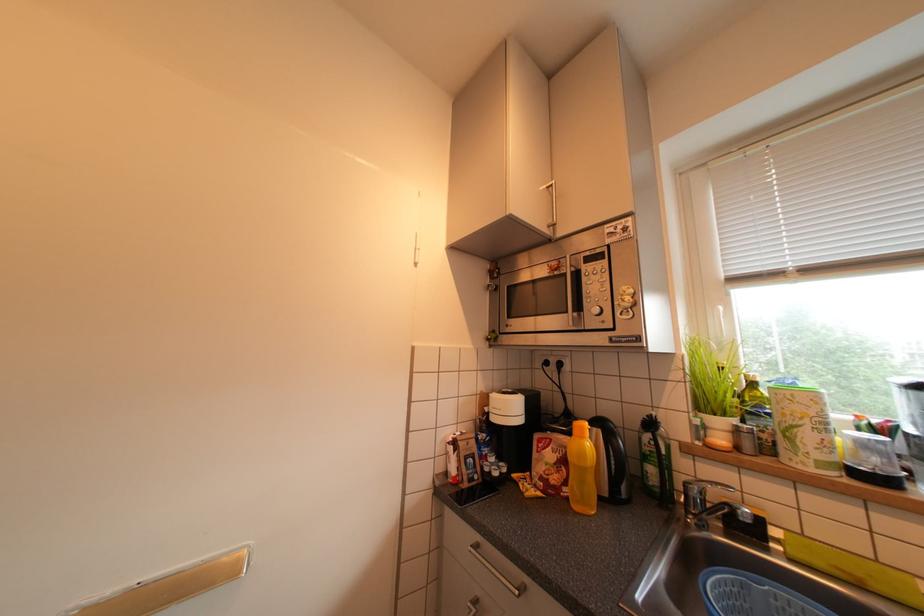
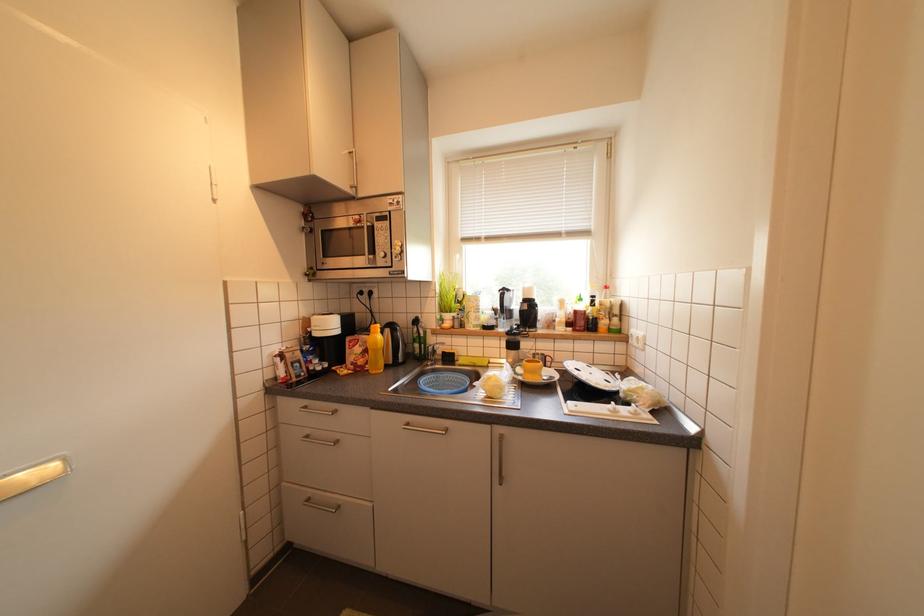
Question: The images are taken continuously from a first-person perspective. In which direction is your viewpoint rotating?

Choices:
 (A) Left
 (B) Right
 (C) Up
 (D) Down

Answer: (B)